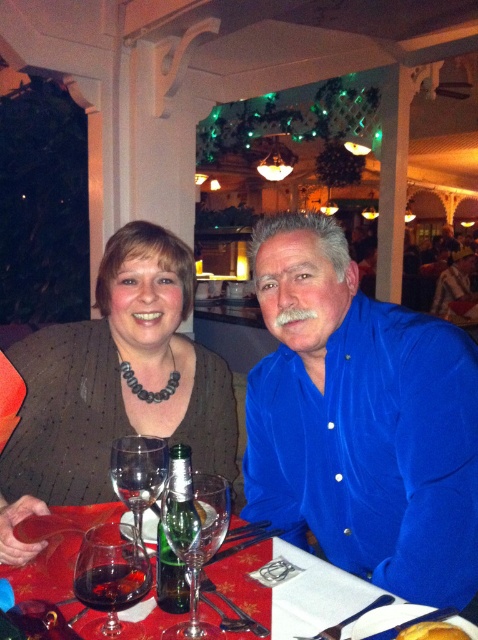
Is blue velvet shirt at center to the left of golden crispy chicken at center from the viewer's perspective?

Indeed, blue velvet shirt at center is positioned on the left side of golden crispy chicken at center.

You are a GUI agent. You are given a task and a screenshot of the screen. Output one action in this format:
    pyautogui.click(x=<x>, y=<y>)
    Task: Click on the blue velvet shirt at center
    
    Given the screenshot: What is the action you would take?
    pyautogui.click(x=360, y=420)

Describe the element at coordinates (360, 420) in the screenshot. I see `blue velvet shirt at center` at that location.

The width and height of the screenshot is (478, 640). Identify the location of blue velvet shirt at center. (360, 420).

You are a GUI agent. You are given a task and a screenshot of the screen. Output one action in this format:
    pyautogui.click(x=<x>, y=<y>)
    Task: Click on the clear glass wine glass at center
    
    Given the screenshot: What is the action you would take?
    pyautogui.click(x=196, y=545)

In the scene shown: Which of these two, clear glass wine glass at center or dark red glass at center, stands shorter?

Standing shorter between the two is dark red glass at center.

The image size is (478, 640). In order to click on clear glass wine glass at center in this screenshot , I will do `click(196, 545)`.

Which is more to the right, matte brown sweater at center or green glass bottle at center?

green glass bottle at center is more to the right.

Is the position of matte brown sweater at center more distant than that of green glass bottle at center?

Yes, it is.

The width and height of the screenshot is (478, 640). What do you see at coordinates (119, 378) in the screenshot?
I see `matte brown sweater at center` at bounding box center [119, 378].

Locate an element on the screen. Image resolution: width=478 pixels, height=640 pixels. matte brown sweater at center is located at coordinates (119, 378).